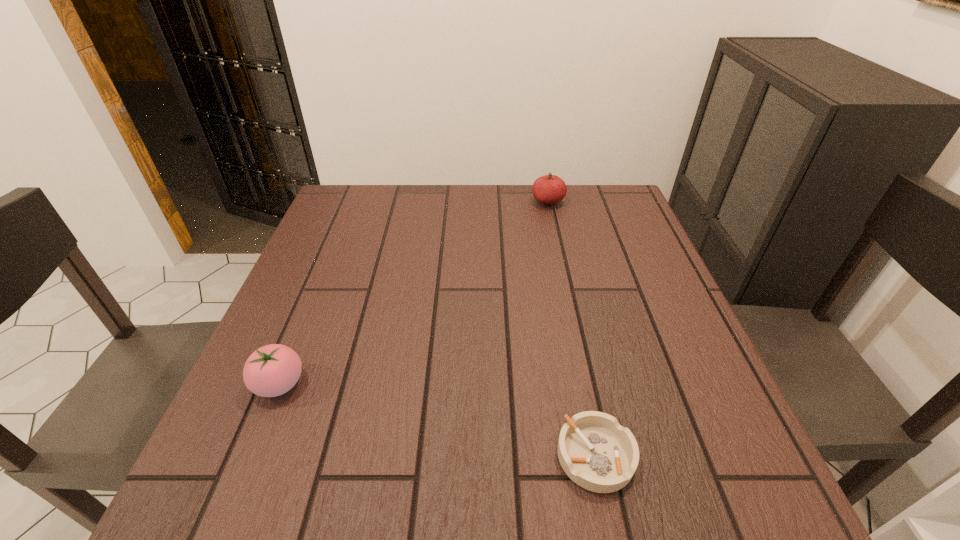
You are a GUI agent. You are given a task and a screenshot of the screen. Output one action in this format:
    pyautogui.click(x=<x>, y=<y>)
    Task: Click on the free spot between the right tomato and the shortest object
    
    Given the screenshot: What is the action you would take?
    [x=572, y=328]

The image size is (960, 540). What are the coordinates of `free spot between the right tomato and the shortest object` in the screenshot? It's located at (572, 328).

Where is `free space between the nearest object and the farther tomato`? The image size is (960, 540). free space between the nearest object and the farther tomato is located at coordinates (572, 328).

At what (x,y) coordinates should I click in order to perform the action: click on vacant region between the nearer tomato and the nearest object. Please return your answer as a coordinate pair (x, y). Image resolution: width=960 pixels, height=540 pixels. Looking at the image, I should click on (438, 420).

This screenshot has width=960, height=540. I want to click on vacant area that lies between the nearest object and the second nearest object, so click(x=438, y=420).

Find the location of a particular element. This screenshot has height=540, width=960. empty location between the nearest object and the farther tomato is located at coordinates (572, 328).

Where is `free spot between the nearest object and the farther tomato`? free spot between the nearest object and the farther tomato is located at coordinates (572, 328).

Identify the location of free space between the farther tomato and the nearer tomato. (414, 293).

This screenshot has width=960, height=540. I want to click on free spot between the shortest object and the second nearest object, so click(438, 420).

I want to click on object that stands as the second closest to the left tomato, so click(x=549, y=189).